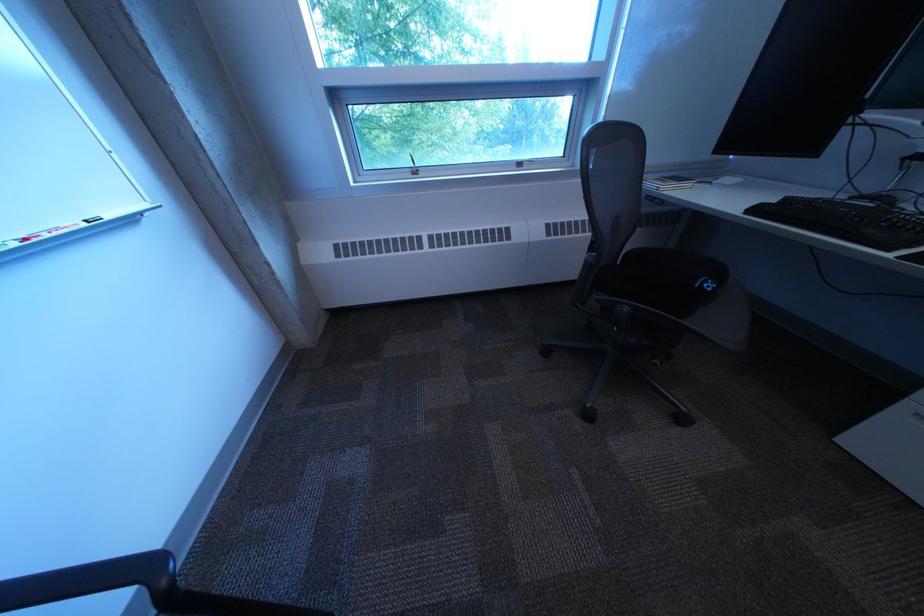
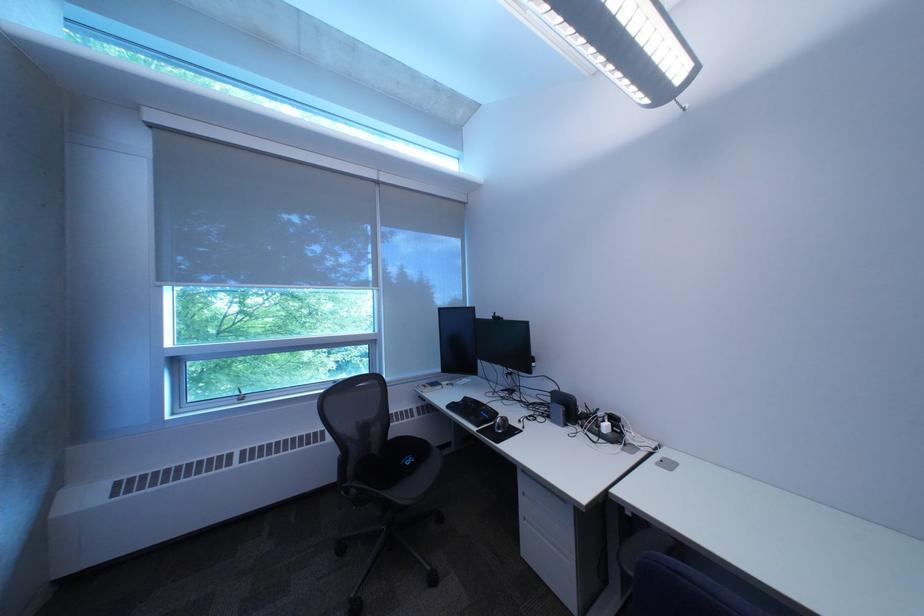
Where in the second image is the point corresponding to (x=722, y=284) from the first image?

(423, 461)